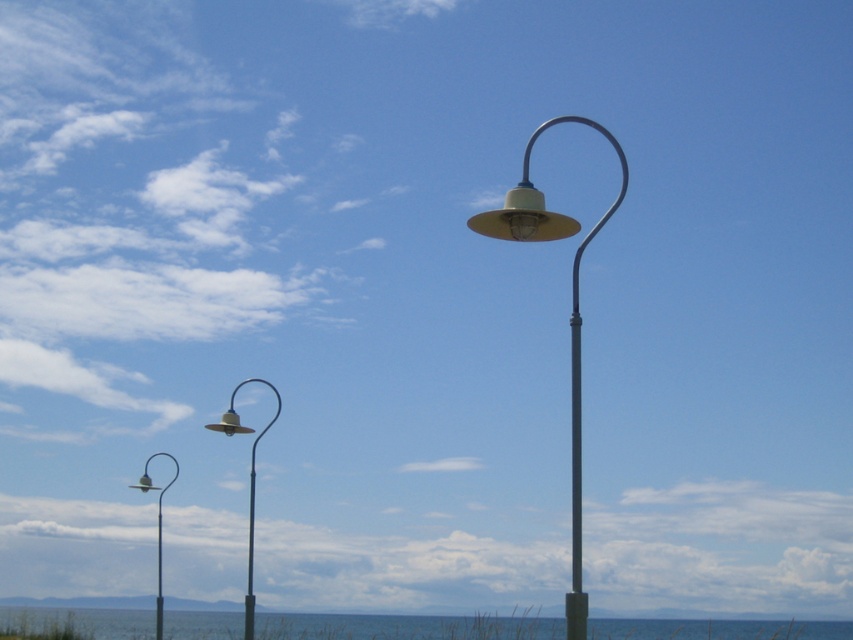
You are standing at the beach and looking at the blue water at lower center and the matte yellow metal lamp post at center. Which object takes up more space in your view?

The blue water at lower center takes up more space in your view since it has a larger size compared to the matte yellow metal lamp post at center.

You are standing at the center of the image and want to walk towards the matte silver lamp post at left. Which direction should you face to head directly towards it?

Since the matte silver lamp post at left is located at point (x=157, y=531), you should face towards the left side of the image to head directly towards it.